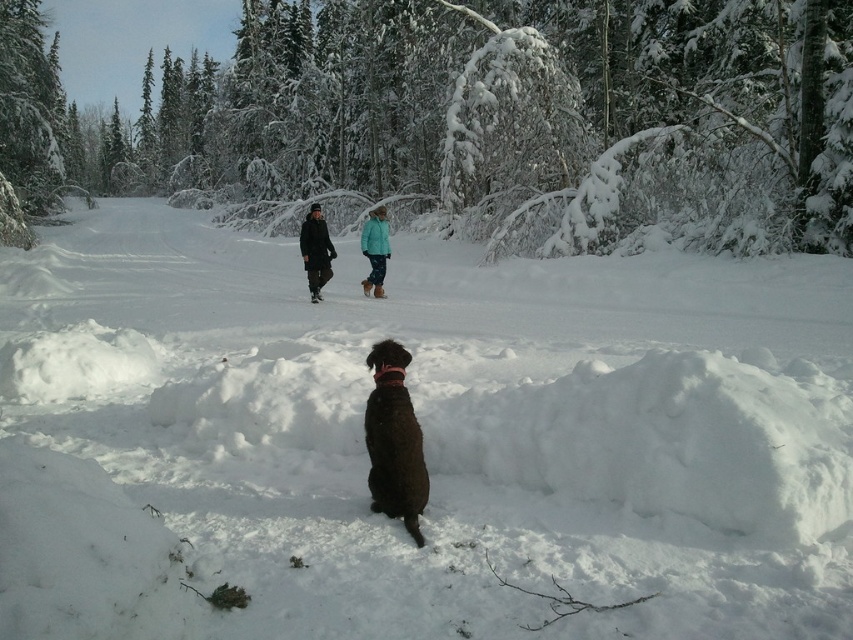
Question: Is white fluffy snow at center positioned at the back of teal fabric jacket at center?

Choices:
 (A) no
 (B) yes

Answer: (A)

Question: Based on their relative distances, which object is farther from the dark brown coat at center?

Choices:
 (A) brown furry dog at lower center
 (B) white fluffy snow at center
 (C) snow-covered evergreen tree at center
 (D) teal fabric jacket at center

Answer: (C)

Question: Does dark brown coat at center have a smaller size compared to teal fabric jacket at center?

Choices:
 (A) yes
 (B) no

Answer: (B)

Question: Is white fluffy snow at center to the left of teal fabric jacket at center from the viewer's perspective?

Choices:
 (A) yes
 (B) no

Answer: (B)

Question: Estimate the real-world distances between objects in this image. Which object is closer to the white fluffy snow at center?

Choices:
 (A) dark brown coat at center
 (B) teal fabric jacket at center

Answer: (B)

Question: Which object appears closest to the camera in this image?

Choices:
 (A) dark brown coat at center
 (B) brown furry dog at lower center
 (C) snow-covered evergreen tree at center

Answer: (B)